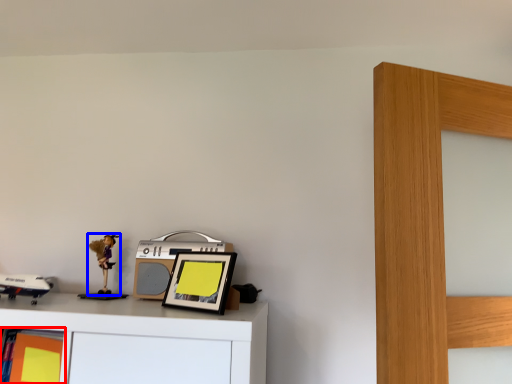
Question: Among these objects, which one is farthest to the camera, shelf (highlighted by a red box) or toy (highlighted by a blue box)?

Choices:
 (A) shelf
 (B) toy

Answer: (B)